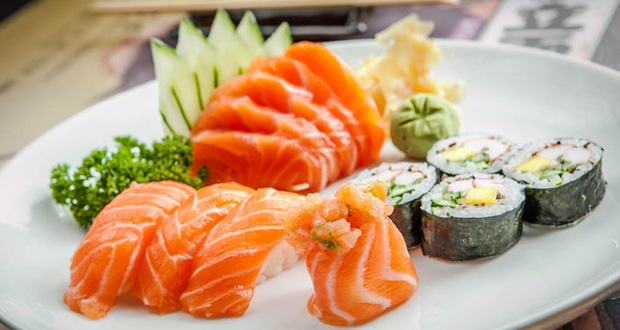
This screenshot has height=330, width=620. Find the location of `plate`. plate is located at coordinates (532, 118), (484, 293), (37, 247).